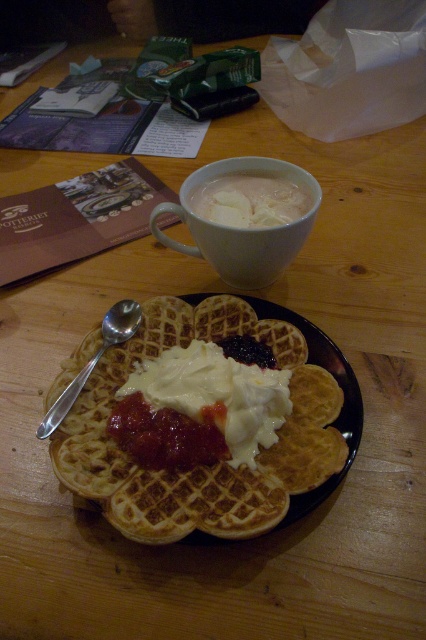
Question: Among these objects, which one is nearest to the camera?

Choices:
 (A) golden brown waffle at center
 (B) silver metallic spoon at left
 (C) white creamy coffee at upper center

Answer: (A)

Question: Which point is closer to the camera taking this photo?

Choices:
 (A) (241, 224)
 (B) (129, 324)

Answer: (B)

Question: From the image, what is the correct spatial relationship of golden brown waffle at center in relation to silver metallic spoon at left?

Choices:
 (A) below
 (B) above

Answer: (A)

Question: Is golden brown waffle at center closer to the viewer compared to silver metallic spoon at left?

Choices:
 (A) yes
 (B) no

Answer: (A)

Question: Which point is farther to the camera?

Choices:
 (A) (43, 426)
 (B) (255, 262)
 (C) (152, 497)
 (D) (215, 205)

Answer: (D)

Question: Can you confirm if golden brown waffle at center is positioned below silver metallic spoon at left?

Choices:
 (A) no
 (B) yes

Answer: (B)